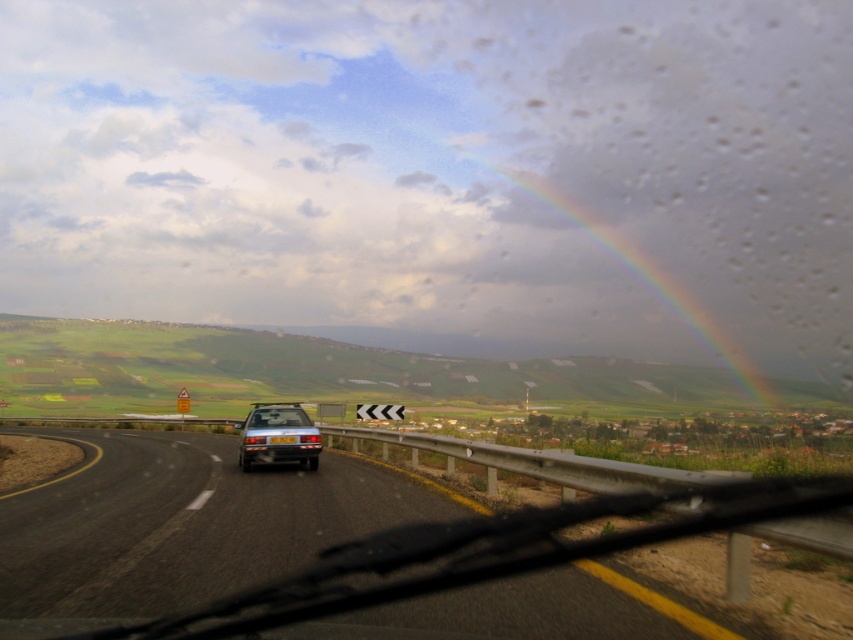
Question: Which point is farther from the camera taking this photo?

Choices:
 (A) (268, 438)
 (B) (302, 426)
 (C) (306, 420)
 (D) (643, 250)

Answer: (D)

Question: Does rainbow at upper center have a greater width compared to clear glass car window at center?

Choices:
 (A) no
 (B) yes

Answer: (B)

Question: Does rainbow at upper center appear on the right side of yellow plastic license plate at center?

Choices:
 (A) no
 (B) yes

Answer: (B)

Question: Which object is closer to the camera taking this photo?

Choices:
 (A) yellow plastic license plate at center
 (B) clear glass car window at center
 (C) rainbow at upper center

Answer: (A)

Question: Which of the following is the farthest from the observer?

Choices:
 (A) rainbow at upper center
 (B) yellow plastic license plate at center
 (C) metallic silver hatchback at center
 (D) clear glass car window at center

Answer: (A)

Question: Is metallic silver hatchback at center below clear glass car window at center?

Choices:
 (A) no
 (B) yes

Answer: (B)